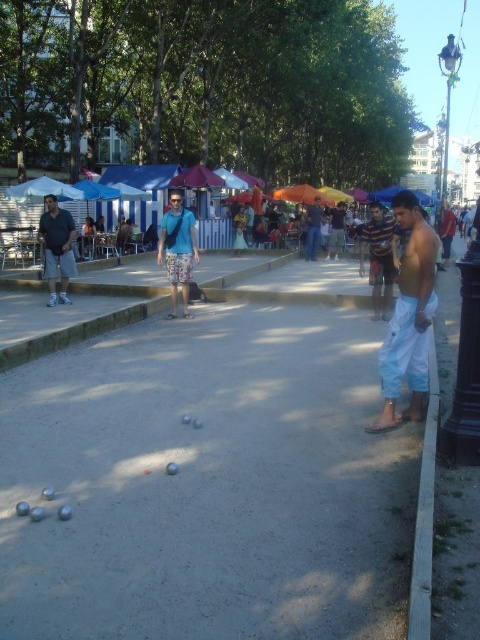
Question: Which point is closer to the camera?

Choices:
 (A) white cotton pants at right
 (B) gray concrete pavement at center
 (C) blue cotton shorts at center

Answer: (A)

Question: Which of the following is the closest to the observer?

Choices:
 (A) blue denim shorts at center
 (B) white cotton pants at right
 (C) white fabric umbrella at upper left

Answer: (B)

Question: Does orange fabric umbrella at center come behind light blue shirt at center?

Choices:
 (A) yes
 (B) no

Answer: (A)

Question: Does orange fabric umbrella at center appear over light blue shirt at center?

Choices:
 (A) yes
 (B) no

Answer: (A)

Question: Which is nearer to the matte gray shorts at left?

Choices:
 (A) white fabric umbrella at upper left
 (B) blue cotton shorts at center

Answer: (B)

Question: Is orange fabric umbrella at center positioned at the back of blue denim shorts at center?

Choices:
 (A) no
 (B) yes

Answer: (B)